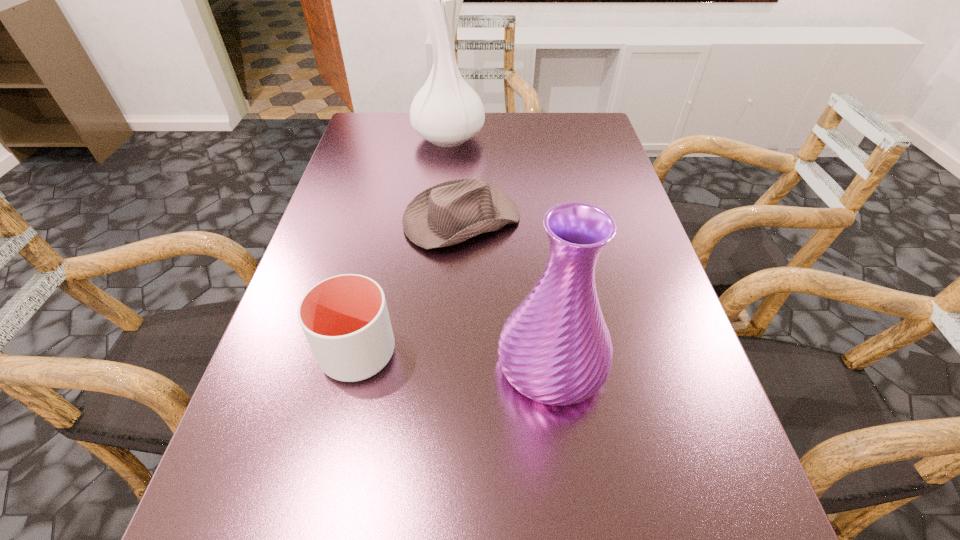
This screenshot has width=960, height=540. What are the coordinates of `the left vase` in the screenshot? It's located at (447, 112).

The height and width of the screenshot is (540, 960). I want to click on the farthest object, so pos(447,112).

Image resolution: width=960 pixels, height=540 pixels. I want to click on the nearer vase, so click(x=555, y=348).

You are a GUI agent. You are given a task and a screenshot of the screen. Output one action in this format:
    pyautogui.click(x=<x>, y=<y>)
    Task: Click on the third shortest object
    
    Given the screenshot: What is the action you would take?
    pyautogui.click(x=555, y=348)

You are a GUI agent. You are given a task and a screenshot of the screen. Output one action in this format:
    pyautogui.click(x=<x>, y=<y>)
    Task: Click on the third tallest object
    The width and height of the screenshot is (960, 540).
    Given the screenshot: What is the action you would take?
    pyautogui.click(x=345, y=318)

Where is `fedora`? fedora is located at coordinates pos(446,214).

You are a GUI agent. You are given a task and a screenshot of the screen. Output one action in this format:
    pyautogui.click(x=<x>, y=<y>)
    Task: Click on the second farthest object
    
    Given the screenshot: What is the action you would take?
    pyautogui.click(x=446, y=214)

This screenshot has width=960, height=540. Find the location of `vacant region located 0.300m on the front of the farther vase`. vacant region located 0.300m on the front of the farther vase is located at coordinates (440, 226).

Identify the location of vacant point located 0.330m on the left of the second tallest object. Image resolution: width=960 pixels, height=540 pixels. (303, 363).

This screenshot has width=960, height=540. I want to click on free space located on the back of the third tallest object, so click(393, 200).